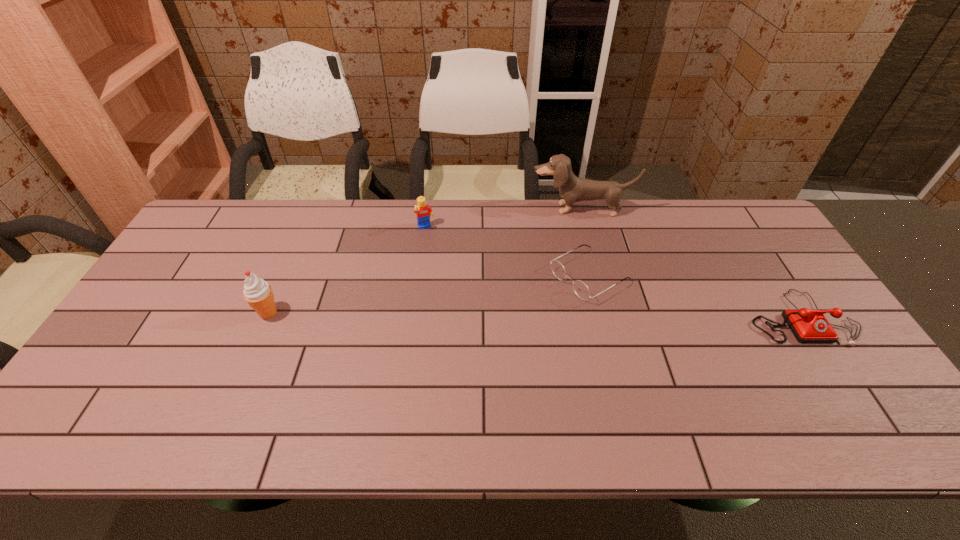
You are a GUI agent. You are given a task and a screenshot of the screen. Output one action in this format:
    pyautogui.click(x=<x>, y=<y>)
    Task: Click on the blank region between the shortest object and the rightmost object
    This screenshot has width=960, height=540.
    Given the screenshot: What is the action you would take?
    [x=694, y=296]

Locate an element on the screen. The image size is (960, 540). vacant area between the Lego and the icecream is located at coordinates (347, 271).

At what (x,y) coordinates should I click in order to perform the action: click on free point between the fourth object from right to left and the icecream. Please return your answer as a coordinate pair (x, y). The width and height of the screenshot is (960, 540). Looking at the image, I should click on (347, 271).

You are a GUI agent. You are given a task and a screenshot of the screen. Output one action in this format:
    pyautogui.click(x=<x>, y=<y>)
    Task: Click on the free space that is in between the second farthest object and the farthest object
    This screenshot has width=960, height=540.
    Given the screenshot: What is the action you would take?
    pyautogui.click(x=503, y=218)

This screenshot has height=540, width=960. What are the coordinates of `free space that is in between the fourth tallest object and the spectacles` in the screenshot? It's located at (694, 296).

Where is `empty location between the spectacles and the second shortest object`? empty location between the spectacles and the second shortest object is located at coordinates (694, 296).

The width and height of the screenshot is (960, 540). I want to click on free space between the icecream and the shortest object, so click(x=429, y=294).

You are a GUI agent. You are given a task and a screenshot of the screen. Output one action in this format:
    pyautogui.click(x=<x>, y=<y>)
    Task: Click on the vacant region between the icecream and the Lego
    The height and width of the screenshot is (540, 960).
    Given the screenshot: What is the action you would take?
    pyautogui.click(x=347, y=271)

Identify which object is located as the nearest to the Lego. Please provide its 2D coordinates. Your answer should be formatted as a tuple, i.e. [(x, y)], where the tuple contains the x and y coordinates of a point satisfying the conditions above.

[(572, 189)]

Choose which object is the fourth nearest neighbor to the rightmost object. Please provide its 2D coordinates. Your answer should be formatted as a tuple, i.e. [(x, y)], where the tuple contains the x and y coordinates of a point satisfying the conditions above.

[(258, 293)]